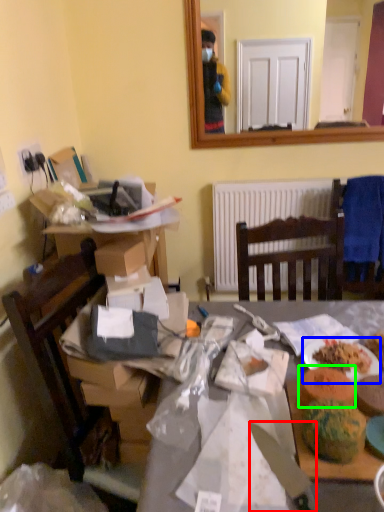
Question: Based on their relative distances, which object is nearer to knife (highlighted by a red box)? Choose from plate (highlighted by a blue box) and food (highlighted by a green box).

Choices:
 (A) plate
 (B) food

Answer: (B)